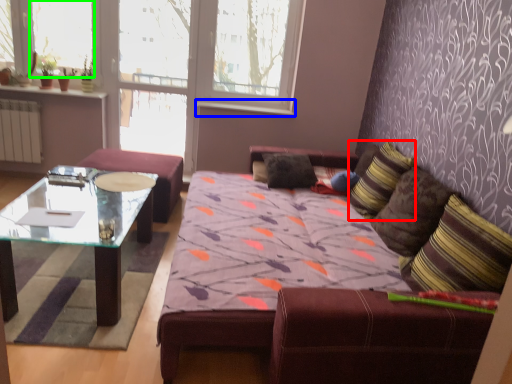
Question: Considering the real-world distances, which object is closest to pillow (highlighted by a red box)? window sill (highlighted by a blue box) or window screen (highlighted by a green box).

Choices:
 (A) window sill
 (B) window screen

Answer: (A)